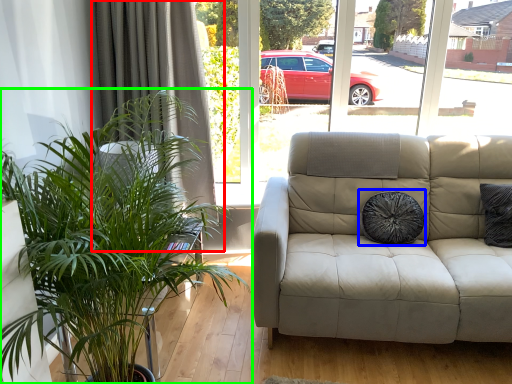
Question: Estimate the real-world distances between objects in this image. Which object is farther from curtain (highlighted by a red box), pillow (highlighted by a blue box) or houseplant (highlighted by a green box)?

Choices:
 (A) pillow
 (B) houseplant

Answer: (A)